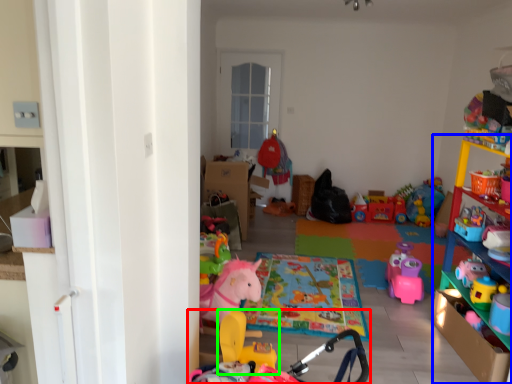
Question: Which is farther away from toy (highlighted by a red box)? shelf (highlighted by a blue box) or toy (highlighted by a green box)?

Choices:
 (A) shelf
 (B) toy

Answer: (A)